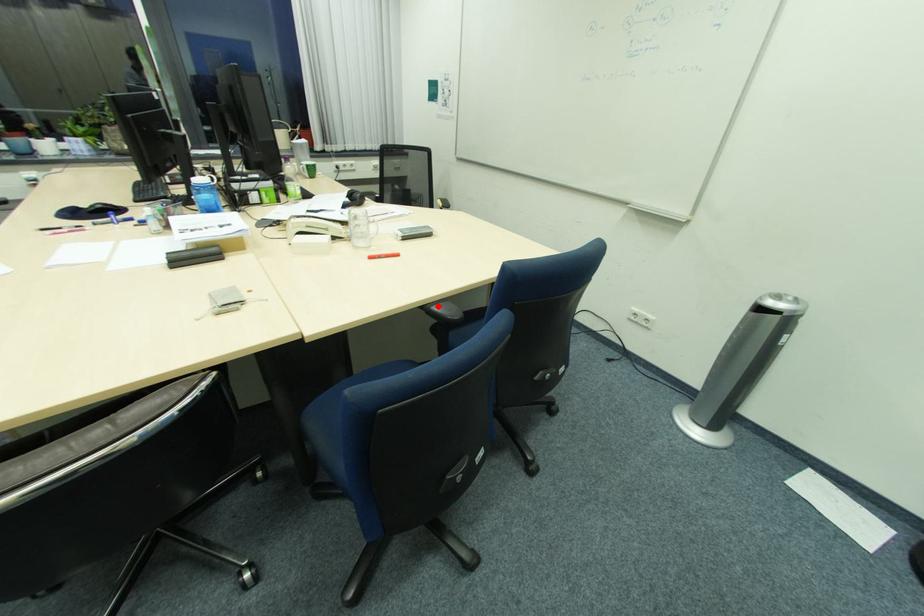
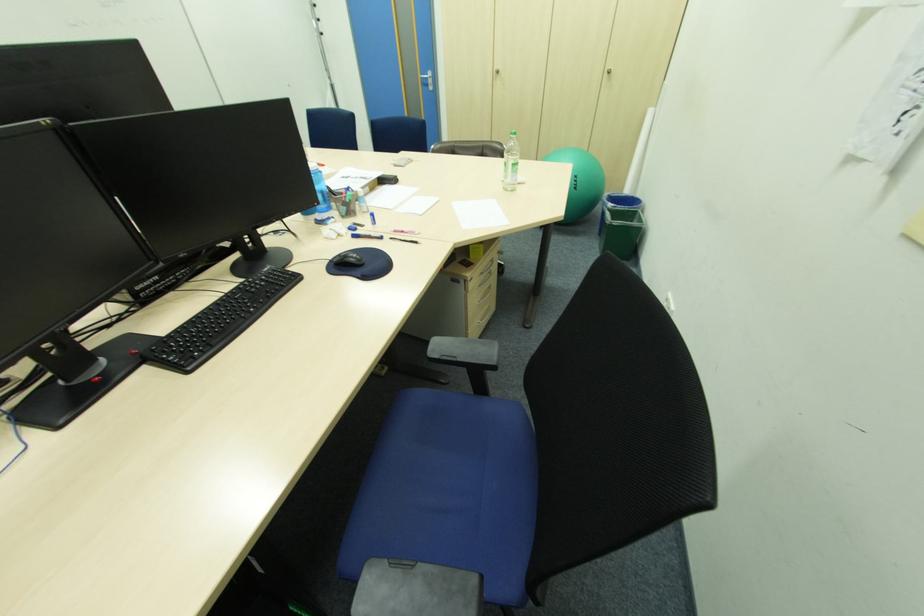
Question: I am providing you with two images of the same scene from different viewpoints. A red point is marked on the first image. Can you still see the location of the red point in image 2?

Choices:
 (A) Yes
 (B) No

Answer: (B)